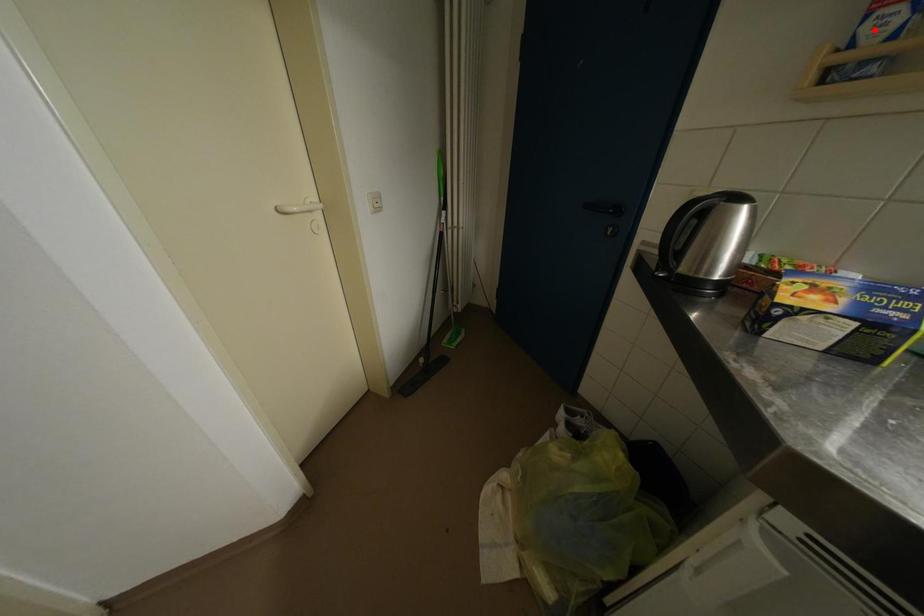
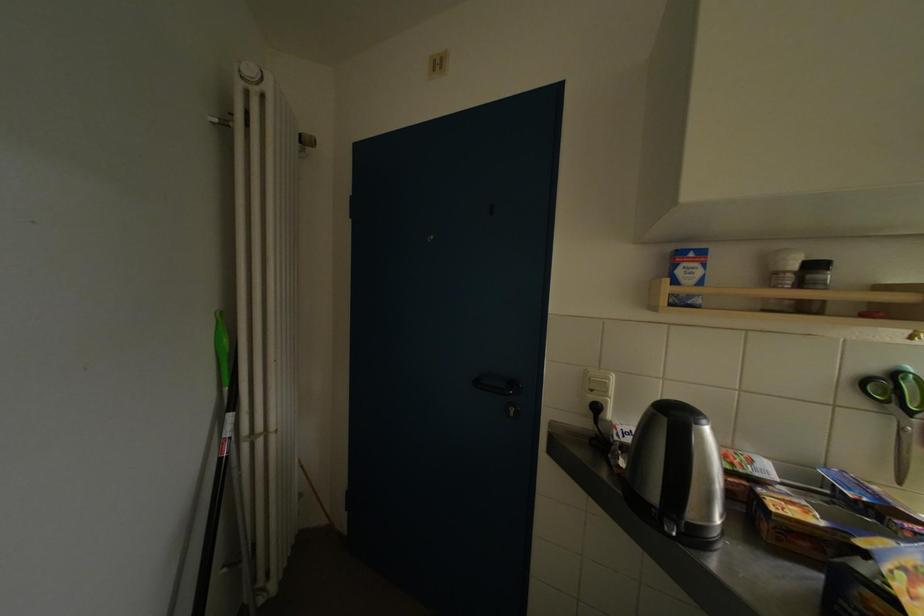
Locate, in the second image, the point that corresponds to the highlighted location in the first image.

(686, 276)